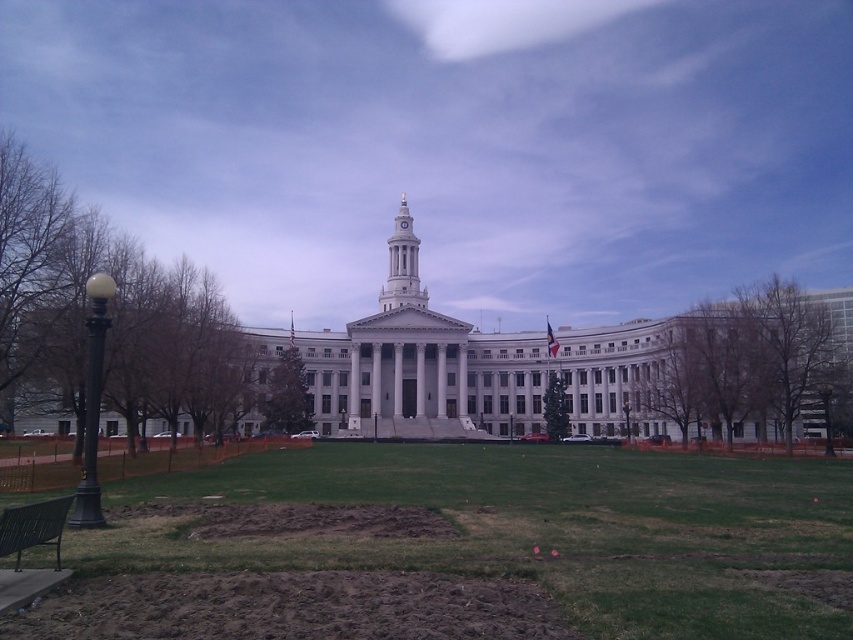
You are a visitor standing in front of the building and want to sit down. The metallic green bench at lower left and the gold metallic spire at center are both visible. Which object is shorter and thus more suitable for sitting?

The metallic green bench at lower left is not as tall as the gold metallic spire at center, making it the shorter object and more suitable for sitting.